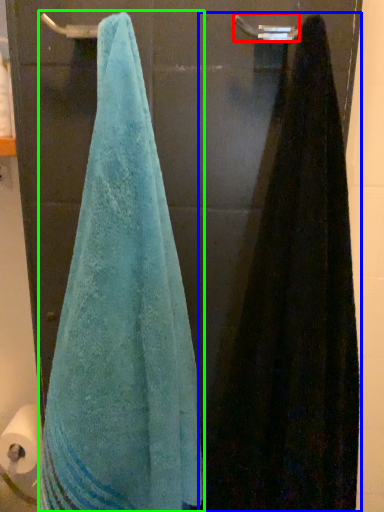
Question: Which is nearer to the towel bar (highlighted by a red box)? towel (highlighted by a blue box) or towel (highlighted by a green box).

Choices:
 (A) towel
 (B) towel

Answer: (A)